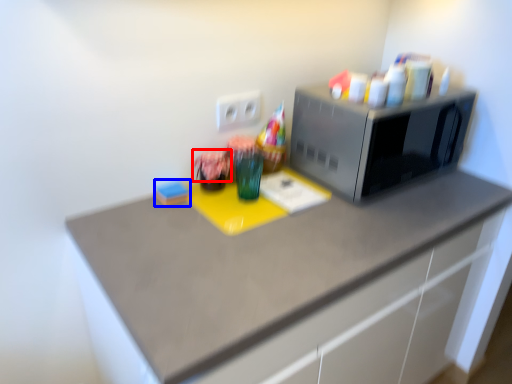
Question: Which object appears closest to the camera in this image, flower (highlighted by a red box) or stationery (highlighted by a blue box)?

Choices:
 (A) flower
 (B) stationery

Answer: (A)